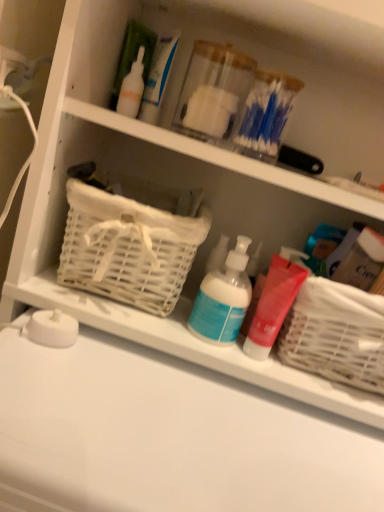
Question: From the image's perspective, is white wicker basket at left, which ranks as the first basket in left-to-right order, beneath blue matte pump bottle at center, marked as the first cleaning product in a left-to-right arrangement?

Choices:
 (A) no
 (B) yes

Answer: (A)

Question: Considering the relative positions of white wicker basket at left, acting as the 2th basket starting from the right, and blue matte pump bottle at center, marked as the first cleaning product in a left-to-right arrangement, in the image provided, is white wicker basket at left, acting as the 2th basket starting from the right, to the left of blue matte pump bottle at center, marked as the first cleaning product in a left-to-right arrangement, from the viewer's perspective?

Choices:
 (A) yes
 (B) no

Answer: (A)

Question: From a real-world perspective, does white wicker basket at left, acting as the 2th basket starting from the right, stand above blue matte pump bottle at center, positioned as the second cleaning product in right-to-left order?

Choices:
 (A) no
 (B) yes

Answer: (B)

Question: Is white wicker basket at left, which ranks as the first basket in left-to-right order, thinner than blue matte pump bottle at center, positioned as the second cleaning product in right-to-left order?

Choices:
 (A) no
 (B) yes

Answer: (A)

Question: Is white wicker basket at left, acting as the 2th basket starting from the right, shorter than blue matte pump bottle at center, marked as the first cleaning product in a left-to-right arrangement?

Choices:
 (A) no
 (B) yes

Answer: (A)

Question: Considering the positions of white wicker basket at left, which ranks as the first basket in left-to-right order, and matte red pump bottle at center, which is counted as the second cleaning product, starting from the left, in the image, is white wicker basket at left, which ranks as the first basket in left-to-right order, bigger or smaller than matte red pump bottle at center, which is counted as the second cleaning product, starting from the left,?

Choices:
 (A) small
 (B) big

Answer: (B)

Question: Is white wicker basket at left, acting as the 2th basket starting from the right, to the left or to the right of matte red pump bottle at center, which ranks as the 1th cleaning product in right-to-left order, in the image?

Choices:
 (A) right
 (B) left

Answer: (B)

Question: Considering their positions, is white wicker basket at left, acting as the 2th basket starting from the right, located in front of or behind matte red pump bottle at center, which ranks as the 1th cleaning product in right-to-left order?

Choices:
 (A) front
 (B) behind

Answer: (A)

Question: Which is correct: white wicker basket at left, which ranks as the first basket in left-to-right order, is inside matte red pump bottle at center, which ranks as the 1th cleaning product in right-to-left order, or outside of it?

Choices:
 (A) outside
 (B) inside

Answer: (A)

Question: In terms of height, does white matte counter top at lower center look taller or shorter compared to matte red pump bottle at center, which ranks as the 1th cleaning product in right-to-left order?

Choices:
 (A) short
 (B) tall

Answer: (B)

Question: Visually, is white matte counter top at lower center positioned to the left or to the right of matte red pump bottle at center, which is counted as the second cleaning product, starting from the left?

Choices:
 (A) right
 (B) left

Answer: (B)

Question: From the image's perspective, is white matte counter top at lower center positioned above or below matte red pump bottle at center, which ranks as the 1th cleaning product in right-to-left order?

Choices:
 (A) above
 (B) below

Answer: (B)

Question: Looking at the image, does white matte counter top at lower center seem bigger or smaller compared to matte red pump bottle at center, which is counted as the second cleaning product, starting from the left?

Choices:
 (A) small
 (B) big

Answer: (B)

Question: Looking at the image, does white matte counter top at lower center seem bigger or smaller compared to white woven basket at right, arranged as the first basket when viewed from the right?

Choices:
 (A) big
 (B) small

Answer: (A)

Question: Would you say white matte counter top at lower center is inside or outside white woven basket at right, positioned as the 2th basket in left-to-right order?

Choices:
 (A) inside
 (B) outside

Answer: (B)